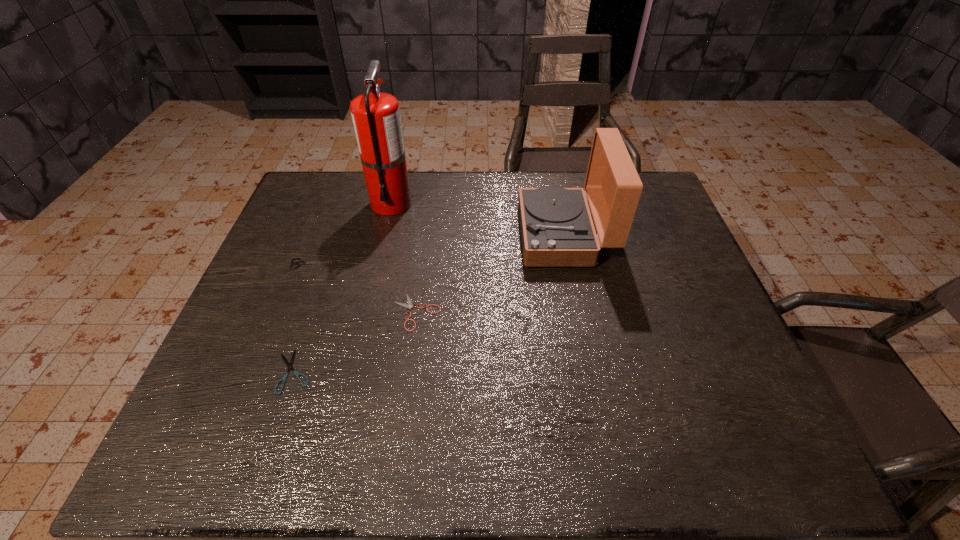
Identify the location of free space at the right edge. click(x=691, y=274).

This screenshot has height=540, width=960. Find the location of `vacant space in between the second tallest object and the fire extinguisher`. vacant space in between the second tallest object and the fire extinguisher is located at coordinates (477, 219).

This screenshot has width=960, height=540. In order to click on free spot between the phonograph record and the tallest shears in this screenshot , I will do `click(438, 249)`.

You are a GUI agent. You are given a task and a screenshot of the screen. Output one action in this format:
    pyautogui.click(x=<x>, y=<y>)
    Task: Click on the empty location between the fire extinguisher and the fourth farthest object
    
    Given the screenshot: What is the action you would take?
    [404, 258]

Locate an element on the screen. free space between the third tallest object and the nearest object is located at coordinates pos(302,318).

Identify the location of free space between the nearest object and the fire extinguisher. (343, 287).

You are a GUI agent. You are given a task and a screenshot of the screen. Output one action in this format:
    pyautogui.click(x=<x>, y=<y>)
    Task: Click on the free space between the fire extinguisher and the nearest shears
    The image size is (960, 540).
    Given the screenshot: What is the action you would take?
    pyautogui.click(x=343, y=287)

You are a GUI agent. You are given a task and a screenshot of the screen. Output one action in this format:
    pyautogui.click(x=<x>, y=<y>)
    Task: Click on the free space between the second nearest shears and the tallest shears
    Image resolution: width=960 pixels, height=540 pixels.
    Given the screenshot: What is the action you would take?
    pyautogui.click(x=364, y=288)

Identify the location of free space that is in between the tallest object and the nearest shears. (343, 287).

What are the coordinates of `free space between the rightmost object and the second nearest shears` in the screenshot? It's located at (491, 274).